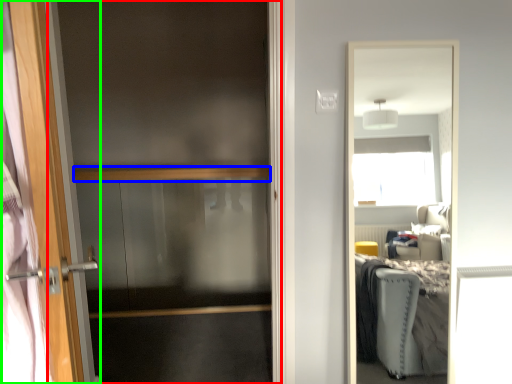
Question: Which is farther away from screen door (highlighted by a red box)? balustrade (highlighted by a blue box) or door (highlighted by a green box)?

Choices:
 (A) balustrade
 (B) door

Answer: (B)